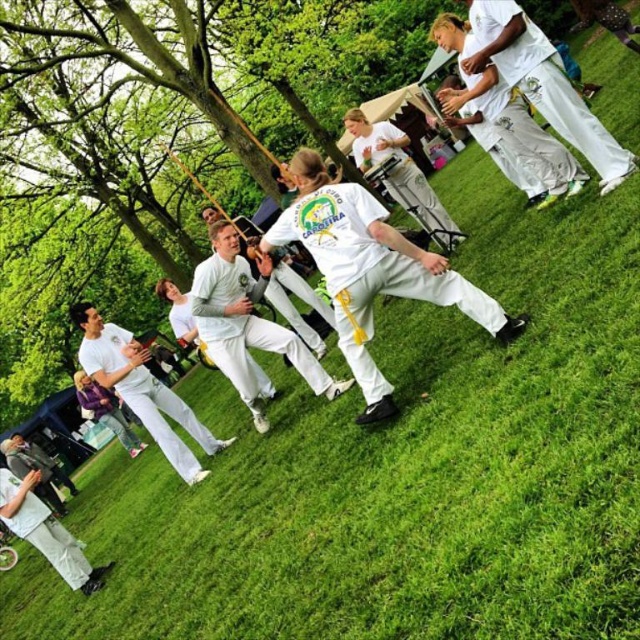
You are a photographer standing at the edge of the park where the Capoeira demonstration is taking place. You want to capture a closeup shot of the white matte uniform at center. Considering your camera has a minimum focusing distance of 3 meters, will you be able to take the photo without moving closer?

The white matte uniform at center is 4.49 meters away from the camera. Since the minimum focusing distance is 3 meters, the photographer can take the closeup shot without moving closer because the distance is within the camera capabilities.